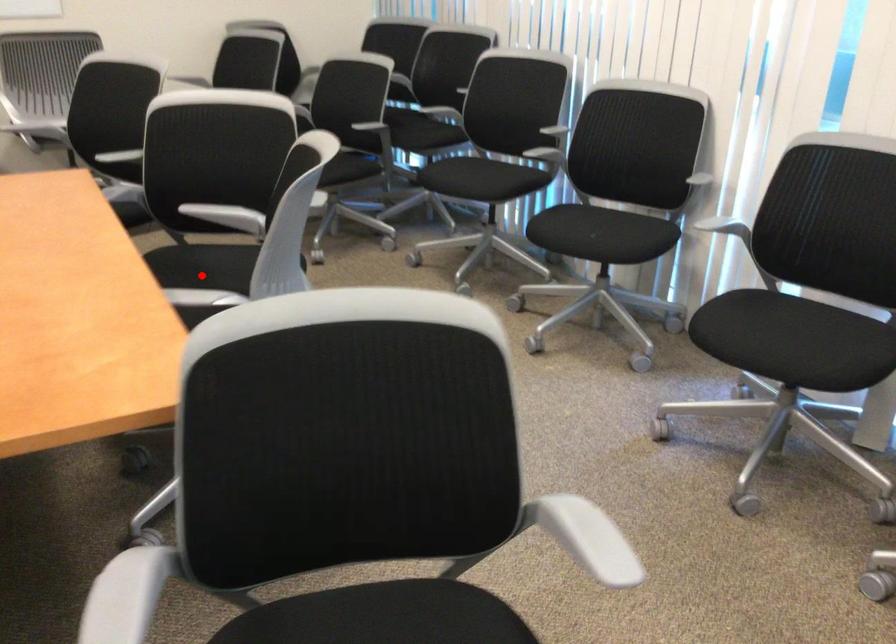
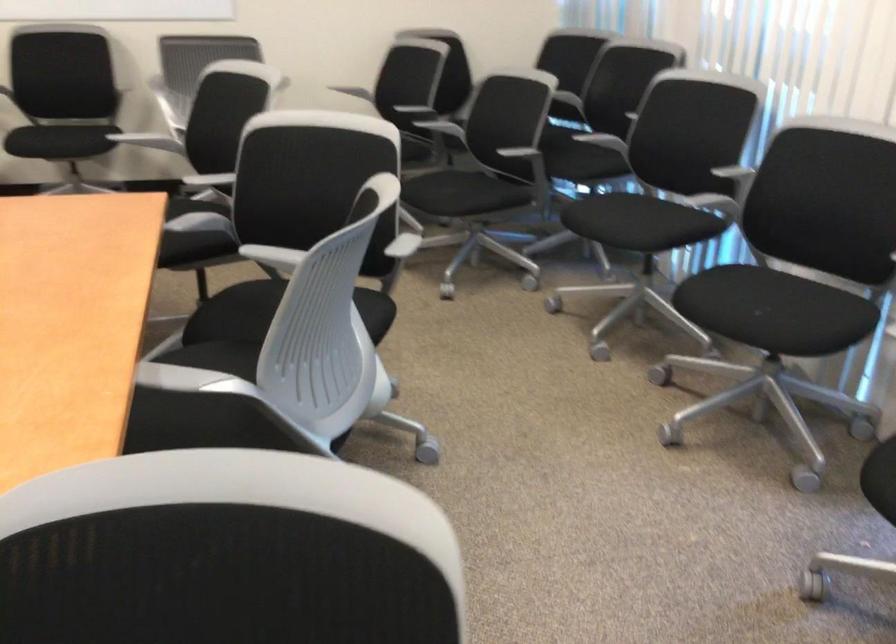
Question: I am providing you with two images of the same scene from different viewpoints. A red point is marked on the first image. At the location where the point appears in image 1, is it still visible in image 2?

Choices:
 (A) Yes
 (B) No

Answer: (B)